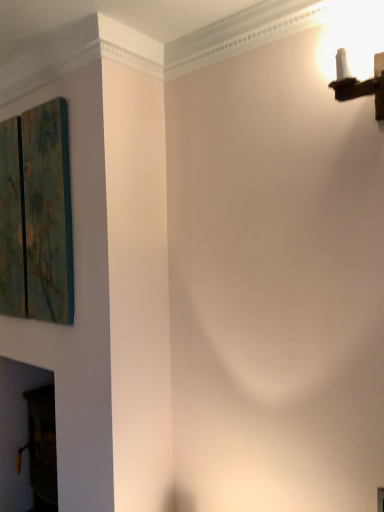
Identify the location of wooden frame at upper left. The width and height of the screenshot is (384, 512). (36, 215).

What do you see at coordinates (36, 215) in the screenshot? I see `wooden frame at upper left` at bounding box center [36, 215].

I want to click on wooden frame at upper left, so click(36, 215).